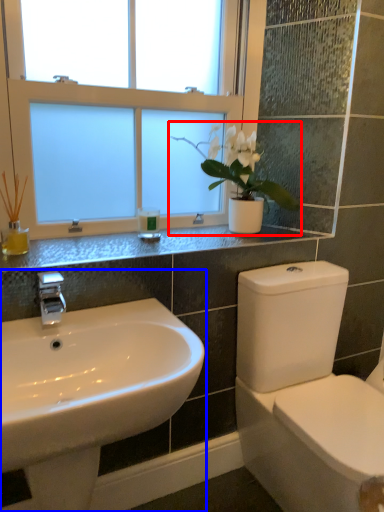
Question: Which point is further to the camera, houseplant (highlighted by a red box) or sink (highlighted by a blue box)?

Choices:
 (A) houseplant
 (B) sink

Answer: (A)